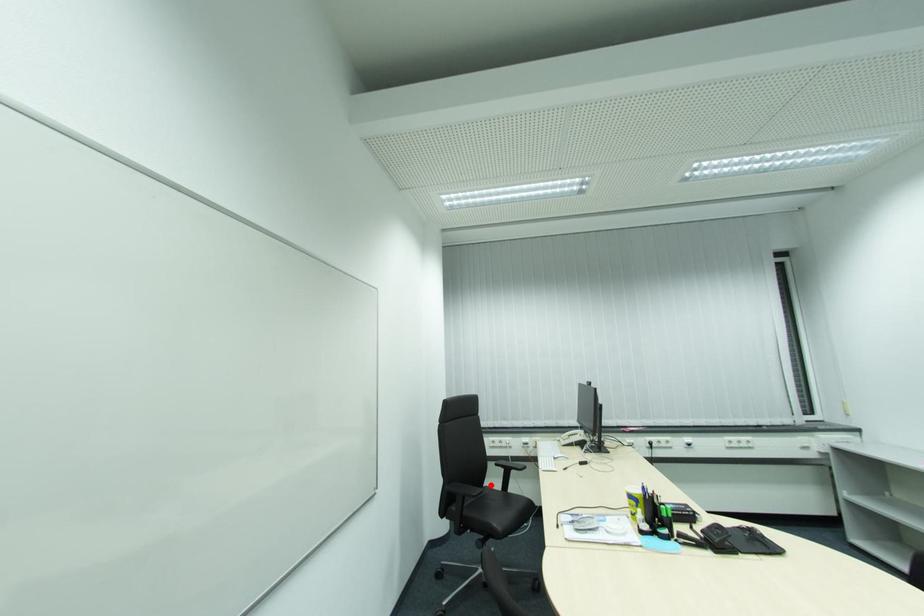
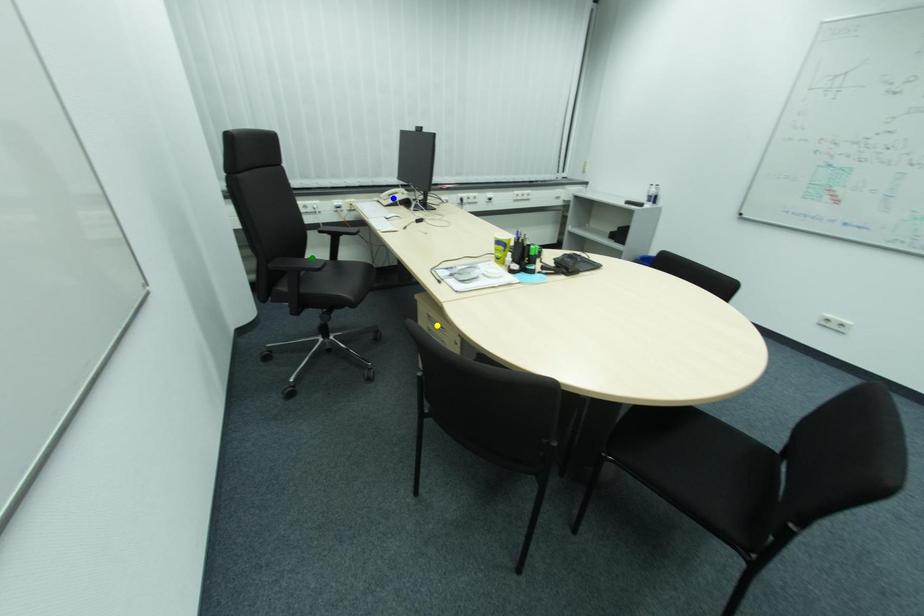
Question: I am providing you with two images of the same scene from different viewpoints. A red point is marked on the first image. You are given multiple points on the second image. Can you choose the point in image 2 that corresponds to the point in image 1?

Choices:
 (A) green point
 (B) blue point
 (C) yellow point

Answer: (A)